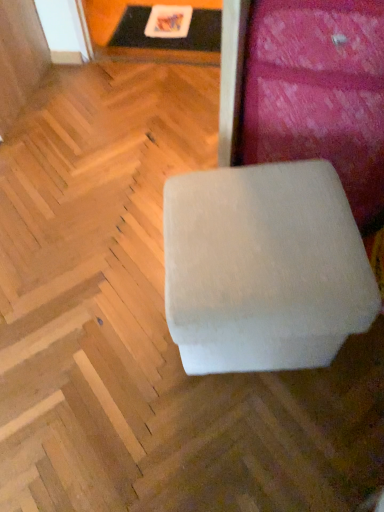
Question: Is white fabric ottoman at center, acting as the second furniture starting from the bottom, not within white plastic tray at upper center?

Choices:
 (A) yes
 (B) no

Answer: (A)

Question: Is white plastic tray at upper center completely or partially inside white fabric ottoman at center, acting as the second furniture starting from the bottom?

Choices:
 (A) yes
 (B) no

Answer: (B)

Question: From a real-world perspective, is white fabric ottoman at center, arranged as the first furniture when viewed from the top, on top of white plastic tray at upper center?

Choices:
 (A) yes
 (B) no

Answer: (A)

Question: Does white fabric ottoman at center, acting as the second furniture starting from the bottom, have a larger size compared to white plastic tray at upper center?

Choices:
 (A) yes
 (B) no

Answer: (A)

Question: Is white fabric ottoman at center, arranged as the first furniture when viewed from the top, to the left of white plastic tray at upper center from the viewer's perspective?

Choices:
 (A) no
 (B) yes

Answer: (A)

Question: In terms of height, does white plastic tray at upper center look taller or shorter compared to white fabric ottoman at center, arranged as the first furniture when viewed from the top?

Choices:
 (A) tall
 (B) short

Answer: (B)

Question: Is white plastic tray at upper center in front of or behind white fabric ottoman at center, acting as the second furniture starting from the bottom, in the image?

Choices:
 (A) front
 (B) behind

Answer: (B)

Question: From the image's perspective, is white plastic tray at upper center located above or below white fabric ottoman at center, arranged as the first furniture when viewed from the top?

Choices:
 (A) below
 (B) above

Answer: (B)

Question: Is white plastic tray at upper center bigger or smaller than white fabric ottoman at center, arranged as the first furniture when viewed from the top?

Choices:
 (A) small
 (B) big

Answer: (A)

Question: Looking at the image, does white fabric ottoman at center, which appears as the 2th furniture when viewed from the top, seem bigger or smaller compared to white plastic tray at upper center?

Choices:
 (A) big
 (B) small

Answer: (A)

Question: Would you say white fabric ottoman at center, which appears as the 2th furniture when viewed from the top, is inside or outside white plastic tray at upper center?

Choices:
 (A) outside
 (B) inside

Answer: (A)

Question: Does point (372, 283) appear closer or farther from the camera than point (163, 48)?

Choices:
 (A) closer
 (B) farther

Answer: (A)

Question: From a real-world perspective, is white fabric ottoman at center, which appears as the 1th furniture when ordered from the bottom, positioned above or below white plastic tray at upper center?

Choices:
 (A) above
 (B) below

Answer: (A)

Question: From the image's perspective, is white fabric ottoman at center, acting as the second furniture starting from the bottom, above or below white fabric ottoman at center, which appears as the 1th furniture when ordered from the bottom?

Choices:
 (A) below
 (B) above

Answer: (B)

Question: Is white fabric ottoman at center, acting as the second furniture starting from the bottom, in front of or behind white fabric ottoman at center, which appears as the 2th furniture when viewed from the top, in the image?

Choices:
 (A) front
 (B) behind

Answer: (B)